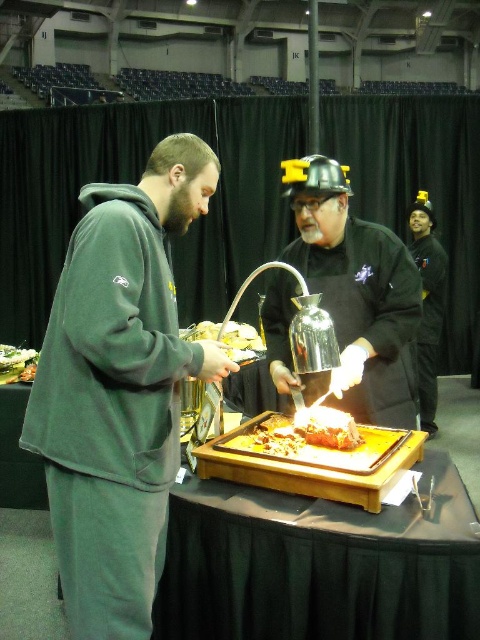
Question: Is black matte helmet at upper right thinner than green leafy vegetable at center?

Choices:
 (A) yes
 (B) no

Answer: (A)

Question: Among these points, which one is farthest from the camera?

Choices:
 (A) (0, 376)
 (B) (216, 337)

Answer: (B)

Question: Among these points, which one is farthest from the camera?

Choices:
 (A) (268, 448)
 (B) (314, 273)
 (C) (82, 586)
 (D) (33, 352)

Answer: (D)

Question: Can you confirm if shiny silver helmet at center is positioned to the right of black matte helmet at upper right?

Choices:
 (A) no
 (B) yes

Answer: (A)

Question: Can you confirm if shiny silver helmet at center is thinner than white fluffy bread at center?

Choices:
 (A) yes
 (B) no

Answer: (B)

Question: Which point appears closest to the camera in this image?

Choices:
 (A) (252, 326)
 (B) (375, 417)

Answer: (B)